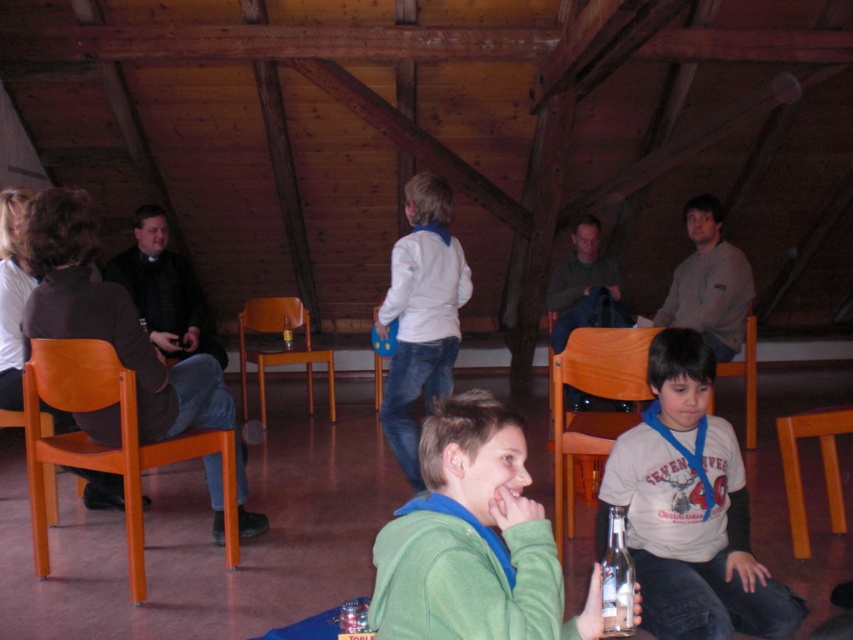
You are a photographer setting up a shoot in this attic. You need to place a small prop between the white cotton shirt at center and the clear glass bottle at lower center. Based on their positions, which side of the bottle should you place it on to keep it aligned with the existing arrangement?

The white cotton shirt at center is positioned on the right side of the clear glass bottle at lower center, so placing the prop to the right of the bottle would align with the existing arrangement.

You are trying to decide which garment to wear for a cold day. Both the green fleece jacket at center and the matte green sweater at center are options. Based on their sizes in the image, which one would you choose if you want something roomier?

The green fleece jacket at center is larger in width than the matte green sweater at center, so it would be the better choice for a roomier fit.